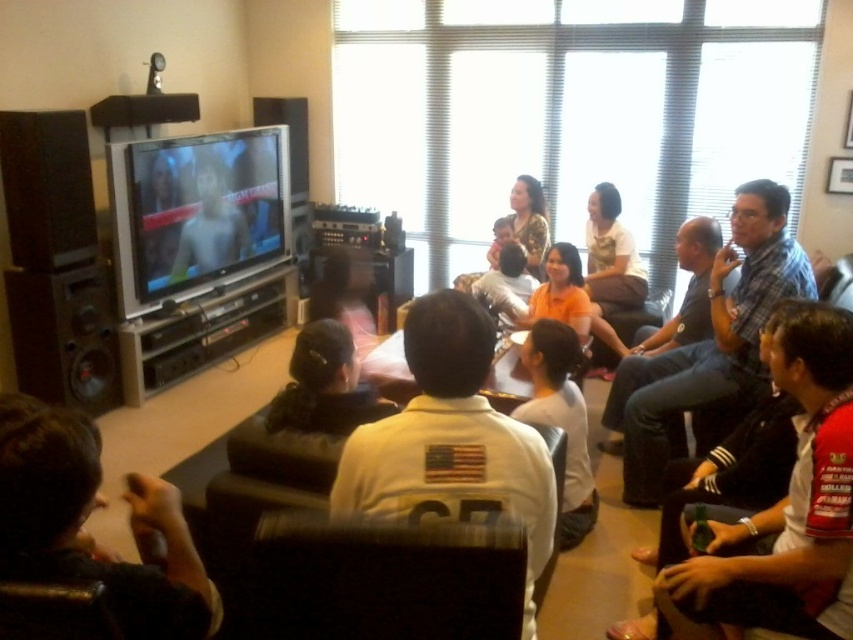
Question: Which of the following is the farthest from the observer?

Choices:
 (A) shiny silver television at center left
 (B) dark brown leather chair at lower left

Answer: (A)

Question: Can you confirm if dark brown leather chair at lower left is positioned to the left of shiny silver television at center left?

Choices:
 (A) no
 (B) yes

Answer: (A)

Question: Can you confirm if shiny silver television at center left is bigger than white matte shirt at center?

Choices:
 (A) no
 (B) yes

Answer: (B)

Question: Which object is closer to the camera taking this photo?

Choices:
 (A) white jersey at center
 (B) shiny silver television at center left
 (C) white matte shirt at center
 (D) smooth skin face at center

Answer: (A)

Question: Which of the following is the farthest from the observer?

Choices:
 (A) smooth skin face at center
 (B) dark brown leather chair at lower left

Answer: (A)

Question: Does white jersey at center appear on the left side of dark brown leather chair at lower left?

Choices:
 (A) yes
 (B) no

Answer: (B)